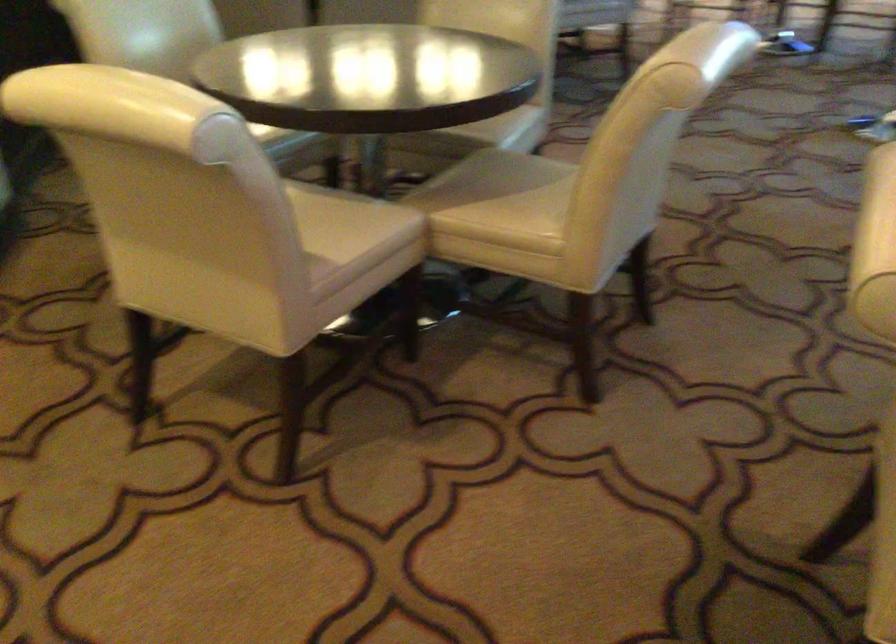
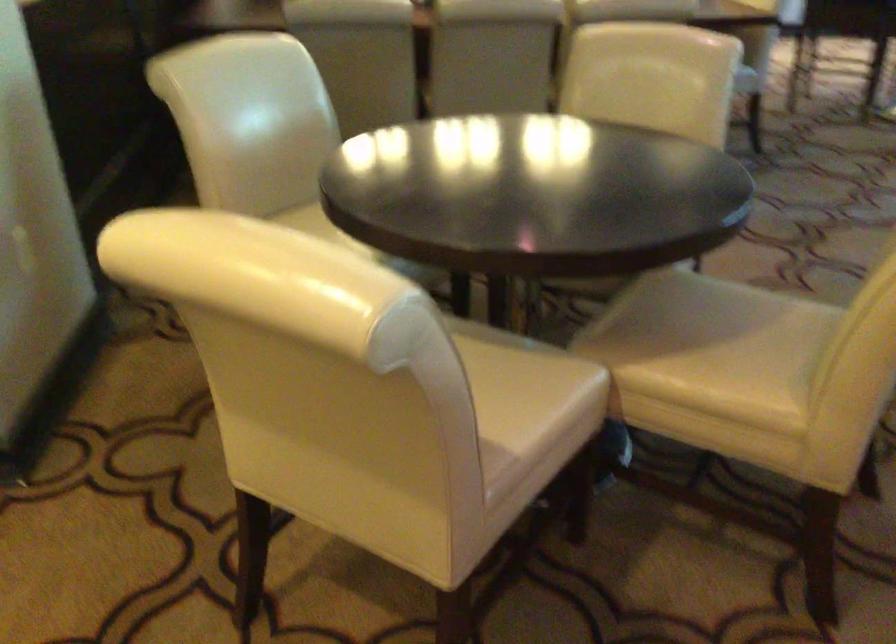
Which direction would the cameraman need to move to produce the second image?

The cameraman moved toward left, forward.